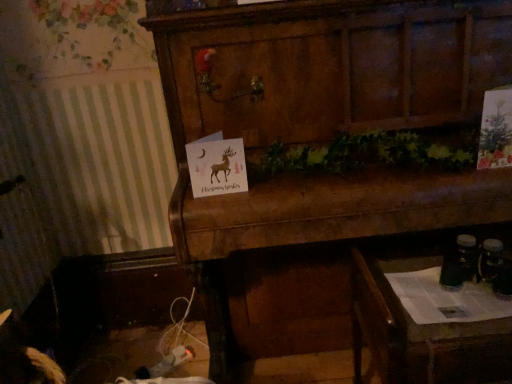
Describe the element at coordinates (424, 337) in the screenshot. I see `wooden drawer at lower right` at that location.

Find the location of `wooden drawer at lower right`. wooden drawer at lower right is located at coordinates (424, 337).

What is the approximate height of wooden drawer at lower right?

60.50 centimeters.

Where is `wooden cabinet at center`? wooden cabinet at center is located at coordinates (334, 174).

The image size is (512, 384). Describe the element at coordinates (334, 174) in the screenshot. I see `wooden cabinet at center` at that location.

Where is `wooden drawer at lower right`? The height and width of the screenshot is (384, 512). wooden drawer at lower right is located at coordinates (424, 337).

Considering the relative positions of wooden cabinet at center and wooden drawer at lower right in the image provided, is wooden cabinet at center to the left of wooden drawer at lower right from the viewer's perspective?

Yes.

Which object is further away from the camera taking this photo, wooden cabinet at center or wooden drawer at lower right?

wooden drawer at lower right is further from the camera.

Considering the positions of points (400, 3) and (469, 325), is point (400, 3) closer to camera compared to point (469, 325)?

No, it is not.

From the image's perspective, is wooden cabinet at center over wooden drawer at lower right?

Indeed, from the image's perspective, wooden cabinet at center is shown above wooden drawer at lower right.

Looking at this image, from a real-world perspective, who is located lower, wooden cabinet at center or wooden drawer at lower right?

wooden drawer at lower right, from a real-world perspective.

Considering the relative sizes of wooden cabinet at center and wooden drawer at lower right in the image provided, is wooden cabinet at center thinner than wooden drawer at lower right?

No.

From the picture: Considering the sizes of objects wooden cabinet at center and wooden drawer at lower right in the image provided, who is taller, wooden cabinet at center or wooden drawer at lower right?

With more height is wooden cabinet at center.

Does wooden cabinet at center have a smaller size compared to wooden drawer at lower right?

Actually, wooden cabinet at center might be larger than wooden drawer at lower right.

Based on the photo, is wooden cabinet at center outside of wooden drawer at lower right?

Yes, wooden cabinet at center is located beyond the bounds of wooden drawer at lower right.

Can you see wooden cabinet at center touching wooden drawer at lower right?

No.

Is wooden drawer at lower right at the back of wooden cabinet at center?

Yes, wooden cabinet at center's orientation is away from wooden drawer at lower right.

Measure the distance between wooden cabinet at center and wooden drawer at lower right.

They are 24.19 centimeters apart.

The image size is (512, 384). I want to click on table that appears behind the wooden cabinet at center, so click(x=424, y=337).

Which is more to the left, wooden drawer at lower right or wooden cabinet at center?

wooden cabinet at center.

Who is more distant, wooden drawer at lower right or wooden cabinet at center?

wooden drawer at lower right is further away from the camera.

Considering the positions of point (490, 368) and point (246, 271), is point (490, 368) closer or farther from the camera than point (246, 271)?

Clearly, point (490, 368) is closer to the camera than point (246, 271).

From the image's perspective, would you say wooden drawer at lower right is positioned over wooden cabinet at center?

Actually, wooden drawer at lower right appears below wooden cabinet at center in the image.

From a real-world perspective, which object rests below the other?

wooden drawer at lower right.

Is wooden drawer at lower right wider or thinner than wooden cabinet at center?

wooden drawer at lower right is thinner than wooden cabinet at center.

Can you confirm if wooden drawer at lower right is shorter than wooden cabinet at center?

Indeed, wooden drawer at lower right has a lesser height compared to wooden cabinet at center.

Considering the relative sizes of wooden drawer at lower right and wooden cabinet at center in the image provided, is wooden drawer at lower right bigger than wooden cabinet at center?

Actually, wooden drawer at lower right might be smaller than wooden cabinet at center.

Is wooden drawer at lower right located outside wooden cabinet at center?

Actually, wooden drawer at lower right is within wooden cabinet at center.

Is wooden drawer at lower right far from wooden cabinet at center?

That's not correct — wooden drawer at lower right is a little close to wooden cabinet at center.

Is wooden drawer at lower right aimed at wooden cabinet at center?

Yes, wooden drawer at lower right is turned towards wooden cabinet at center.

Measure the distance from wooden drawer at lower right to wooden cabinet at center.

wooden drawer at lower right is 24.19 centimeters away from wooden cabinet at center.

You are a GUI agent. You are given a task and a screenshot of the screen. Output one action in this format:
    pyautogui.click(x=<x>, y=<y>)
    Task: Click on the furniture in front of the wooden drawer at lower right
    The width and height of the screenshot is (512, 384).
    Given the screenshot: What is the action you would take?
    pyautogui.click(x=334, y=174)

At what (x,y) coordinates should I click in order to perform the action: click on furniture in front of the wooden drawer at lower right. Please return your answer as a coordinate pair (x, y). Looking at the image, I should click on [334, 174].

Find the location of `table behind the wooden cabinet at center`. table behind the wooden cabinet at center is located at coordinates (424, 337).